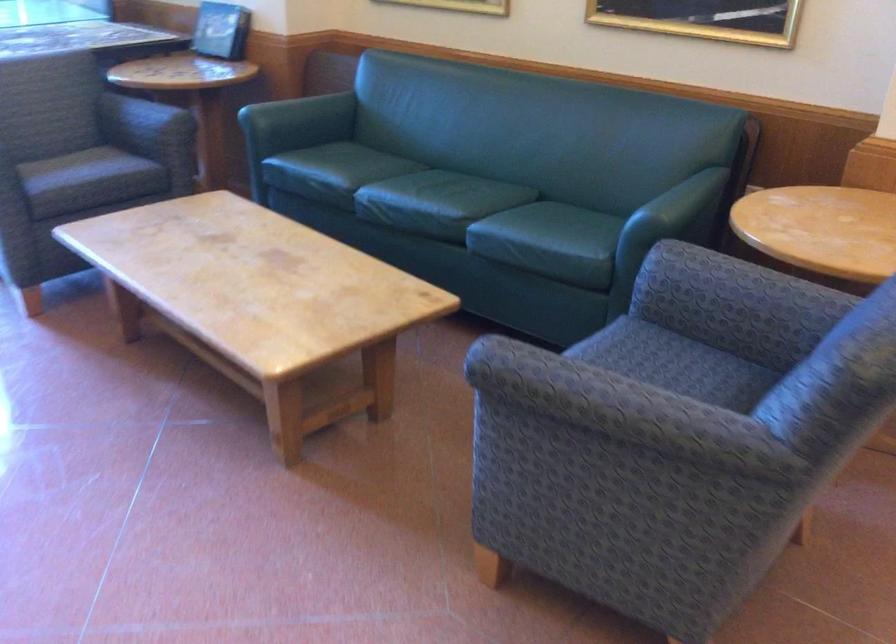
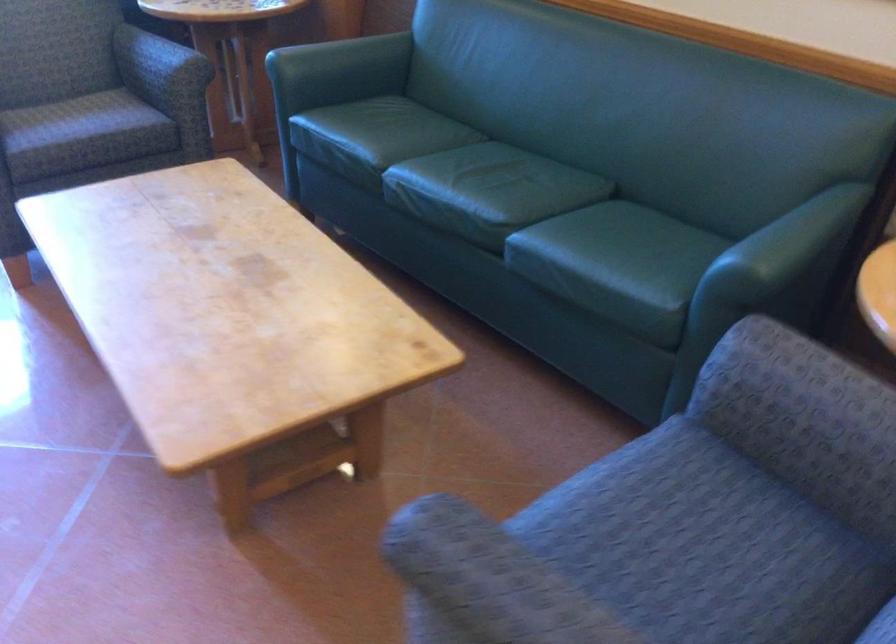
The point at (655, 377) is marked in the first image. Where is the corresponding point in the second image?

(690, 540)